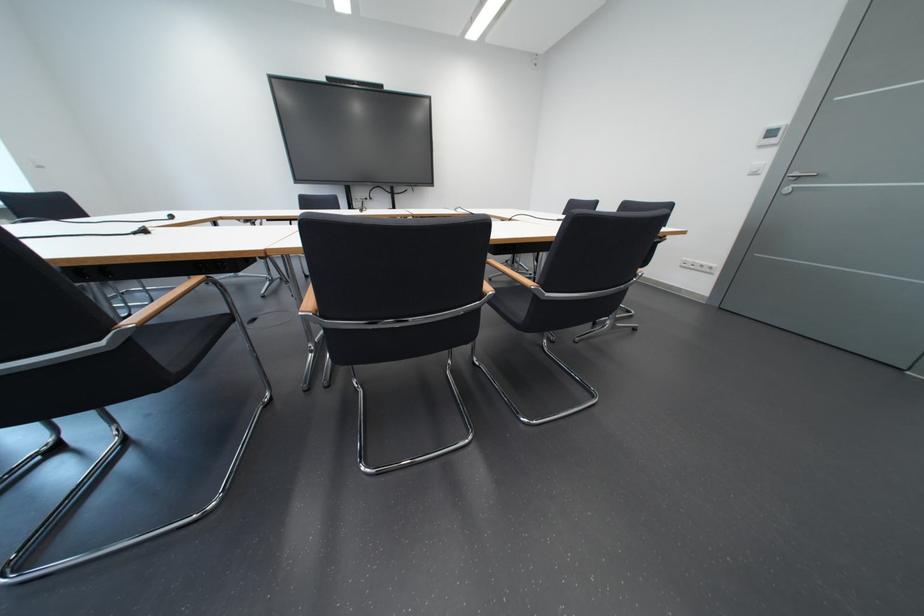
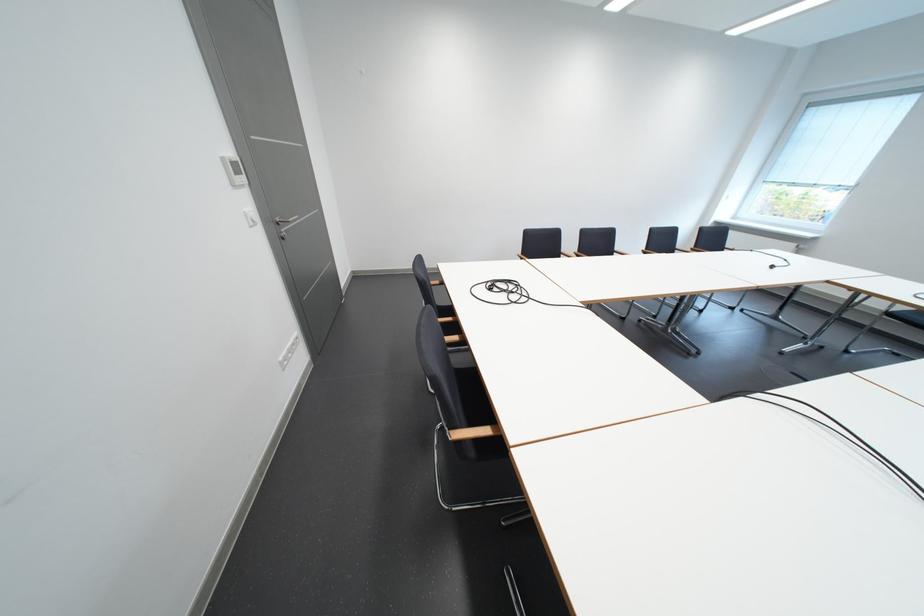
Question: I am providing you with two images of the same scene from different viewpoints. After the viewpoint changes to image2, which objects are now occluded?

Choices:
 (A) wooden chair armrest
 (B) black chair sitting surface
 (C) white light switch
 (D) black leather boot

Answer: (B)